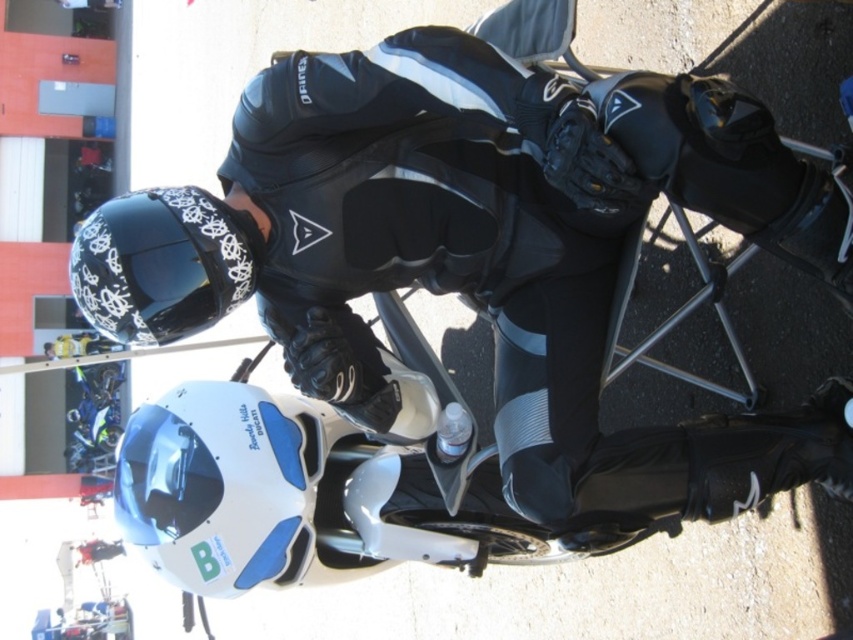
This screenshot has height=640, width=853. I want to click on black leather motorcycle rider at center, so tap(476, 252).

Between point (405, 240) and point (122, 515), which one is positioned behind?

Positioned behind is point (122, 515).

The height and width of the screenshot is (640, 853). I want to click on black leather motorcycle rider at center, so coord(476,252).

Does point (254, 420) lie in front of point (102, 291)?

No, (254, 420) is behind (102, 291).

Is white matte helmet at lower center taller than black glossy helmet at upper left?

Yes.

Locate an element on the screen. white matte helmet at lower center is located at coordinates (219, 484).

Find the location of a particular element. The width and height of the screenshot is (853, 640). white matte helmet at lower center is located at coordinates (219, 484).

Which is above, black leather motorcycle rider at center or black glossy helmet at upper left?

black glossy helmet at upper left

Based on the photo, is black leather motorcycle rider at center to the right of black glossy helmet at upper left from the viewer's perspective?

Indeed, black leather motorcycle rider at center is positioned on the right side of black glossy helmet at upper left.

Measure the distance between point [518,84] and camera.

Point [518,84] is 5.68 feet from camera.

Where is `black leather motorcycle rider at center`? The image size is (853, 640). black leather motorcycle rider at center is located at coordinates (476, 252).